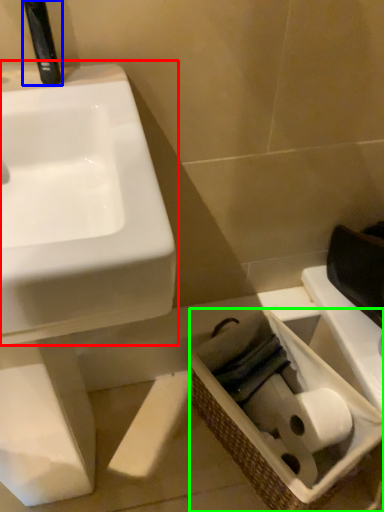
Question: Based on their relative distances, which object is nearer to sink (highlighted by a red box)? Choose from plumbing fixture (highlighted by a blue box) and basket (highlighted by a green box).

Choices:
 (A) plumbing fixture
 (B) basket

Answer: (A)